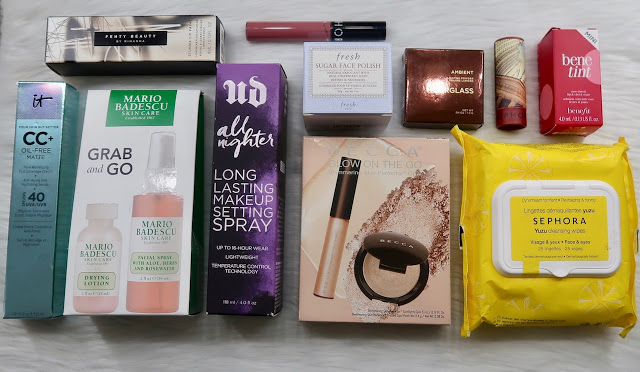
Image resolution: width=640 pixels, height=372 pixels. I want to click on tub, so click(404, 265).